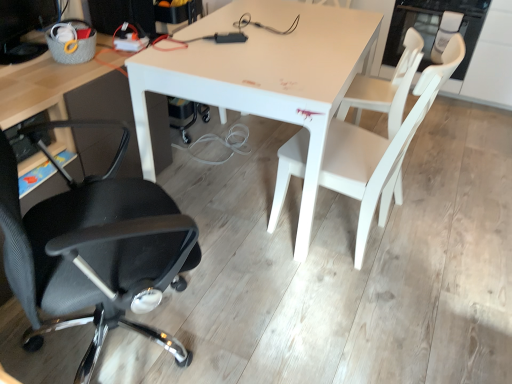
Locate an element on the screen. vacant region to the right of white matte table at center is located at coordinates (452, 191).